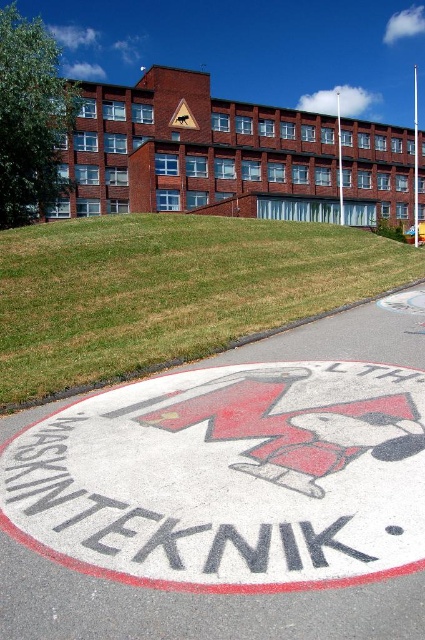
Is point (146, 522) more distant than point (181, 109)?

No, (146, 522) is in front of (181, 109).

Describe the element at coordinates (229, 477) in the screenshot. I see `white asphalt circle at center` at that location.

Is point (342, 545) behind point (181, 106)?

No, it is not.

Identify the location of white asphalt circle at center. This screenshot has height=640, width=425. (229, 477).